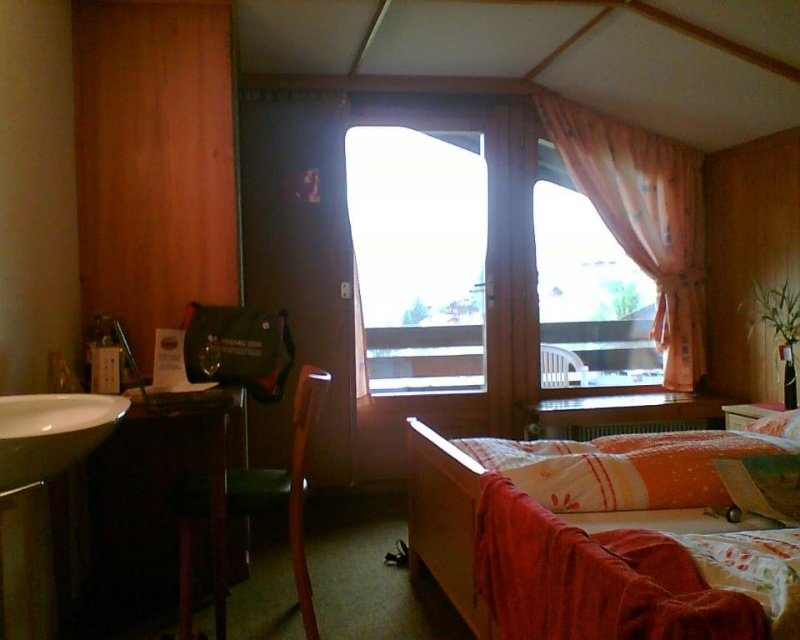
Is pink fabric curtain at upper right smaller than green fabric chair at lower left?

Indeed, pink fabric curtain at upper right has a smaller size compared to green fabric chair at lower left.

Can you confirm if pink fabric curtain at upper right is positioned to the right of green fabric chair at lower left?

Indeed, pink fabric curtain at upper right is positioned on the right side of green fabric chair at lower left.

Is point (570, 156) farther from camera compared to point (294, 465)?

Yes, it is behind point (294, 465).

Image resolution: width=800 pixels, height=640 pixels. Identify the location of pink fabric curtain at upper right. (644, 218).

Can you confirm if wooden bed at lower right is smaller than matte plastic chair at center?

Incorrect, wooden bed at lower right is not smaller in size than matte plastic chair at center.

Does wooden bed at lower right have a lesser width compared to matte plastic chair at center?

Incorrect, wooden bed at lower right's width is not less than matte plastic chair at center's.

Which is behind, point (512, 609) or point (568, 360)?

The point (568, 360) is behind.

Find the location of a particular element. This screenshot has height=640, width=800. wooden bed at lower right is located at coordinates (613, 532).

Between white glossy sink at lower left and matte plastic chair at center, which one is positioned higher?

white glossy sink at lower left

Find the location of `white glossy sink at lower left`. white glossy sink at lower left is located at coordinates (52, 433).